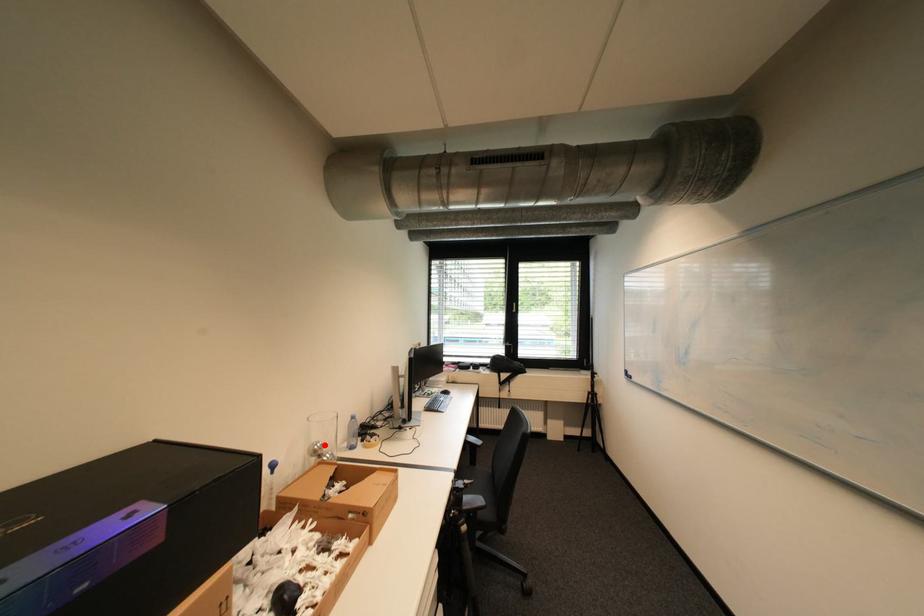
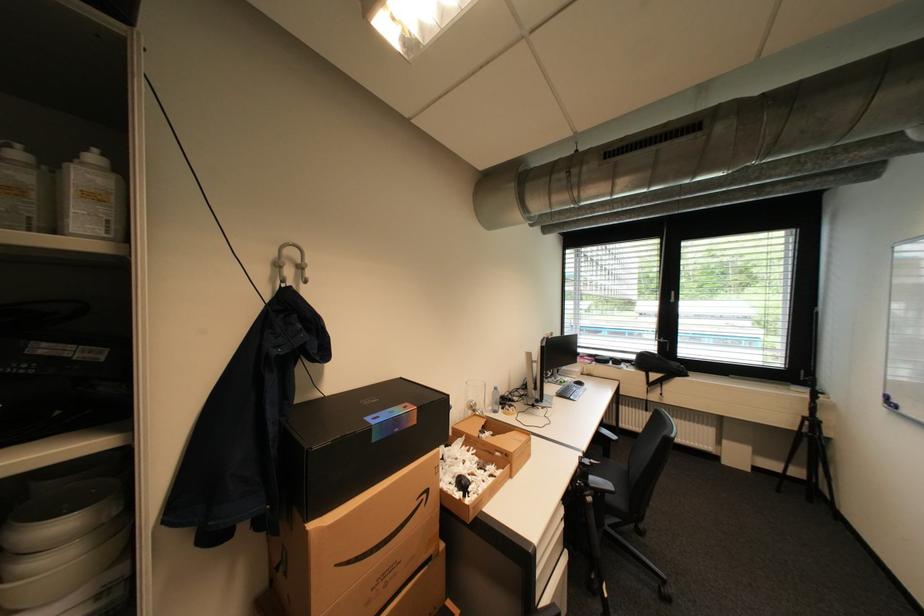
Question: I am providing you with two images of the same scene from different viewpoints. In image1, a red point is highlighted. Considering the same 3D point in image2, which of the following is correct?

Choices:
 (A) It is closer
 (B) It is farther

Answer: (B)